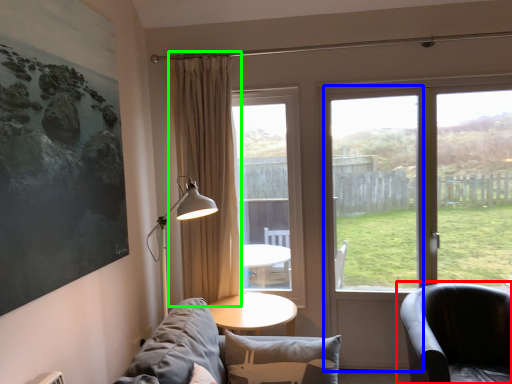
Question: Estimate the real-world distances between objects in this image. Which object is farther from chair (highlighted by a red box), screen door (highlighted by a blue box) or curtain (highlighted by a green box)?

Choices:
 (A) screen door
 (B) curtain

Answer: (B)